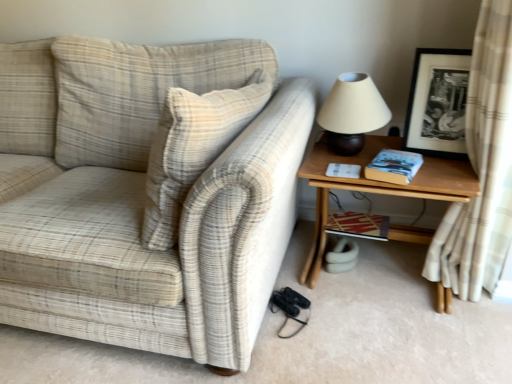
I want to click on unoccupied area in front of wooden table at right, so click(x=394, y=341).